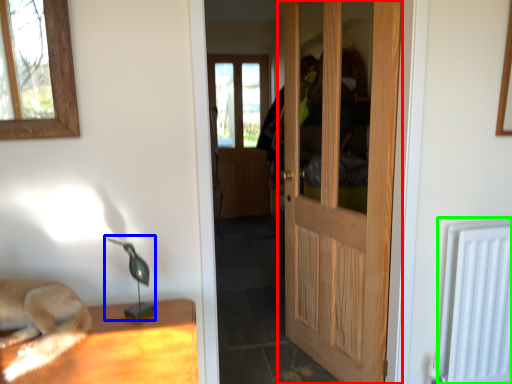
Question: Estimate the real-world distances between objects in this image. Which object is farther from door (highlighted by a red box), table lamp (highlighted by a blue box) or radiator (highlighted by a green box)?

Choices:
 (A) table lamp
 (B) radiator

Answer: (A)